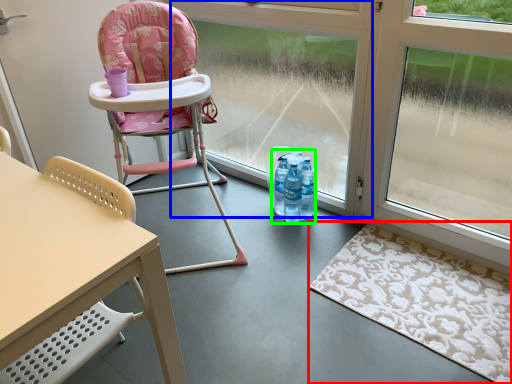
Question: Estimate the real-world distances between objects in this image. Which object is farther from mat (highlighted by a red box), window frame (highlighted by a blue box) or bottle (highlighted by a green box)?

Choices:
 (A) window frame
 (B) bottle

Answer: (A)